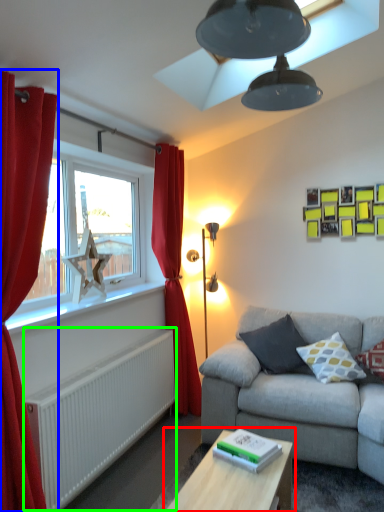
Question: Which object is positioned closest to table (highlighted by a red box)? Select from curtain (highlighted by a blue box) and radiator (highlighted by a green box).

Choices:
 (A) curtain
 (B) radiator

Answer: (B)